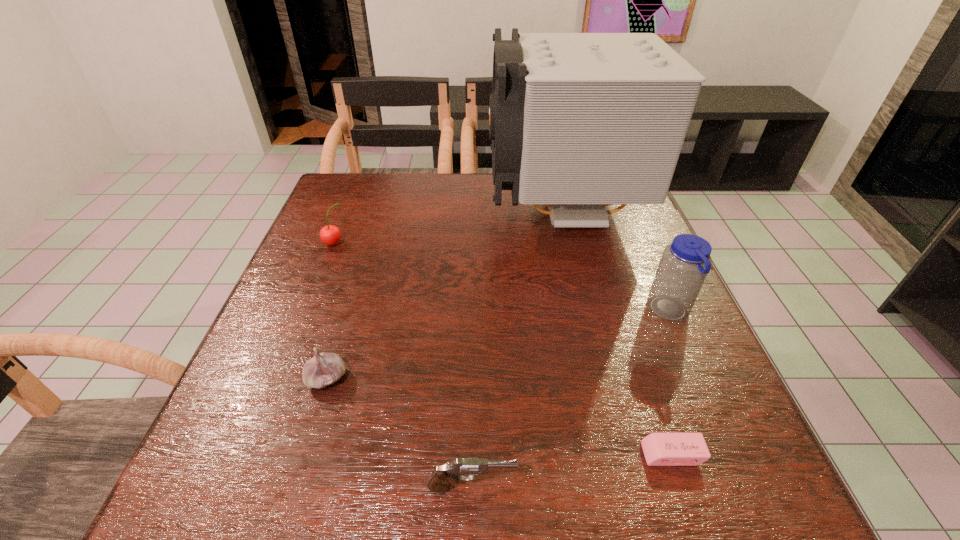
Identify the location of vacant space at the left edge. The height and width of the screenshot is (540, 960). (309, 310).

Find the location of `vacant space at the right edge of the desktop`. vacant space at the right edge of the desktop is located at coordinates (673, 336).

Where is `free space at the far left corner`? This screenshot has height=540, width=960. free space at the far left corner is located at coordinates (389, 173).

Locate an element on the screen. blank space at the far right corner of the desktop is located at coordinates (636, 211).

Where is `free point at the near right corner`? This screenshot has width=960, height=540. free point at the near right corner is located at coordinates (668, 471).

I want to click on vacant region between the eraser and the fan, so click(x=617, y=332).

Find the location of a particular element. free space between the fourth farthest object and the second tallest object is located at coordinates (498, 345).

Identify the location of vacant space that is in between the fourth shortest object and the shortest object. The width and height of the screenshot is (960, 540). (503, 349).

This screenshot has height=540, width=960. I want to click on blank region between the eraser and the fourth nearest object, so click(x=671, y=382).

Find the location of `free area in between the fourth shortest object and the water bottle`. free area in between the fourth shortest object and the water bottle is located at coordinates (502, 278).